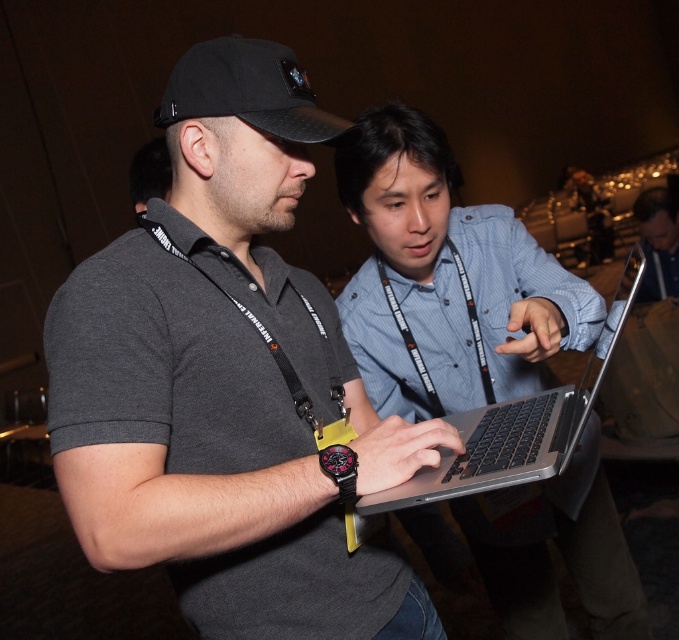
Please provide the exact coordinates of the dark gray polo shirt at center in the image. The coordinate system uses the bottom left corner as the origin point. The x and y values are normalized between 0 and 1. Please answer in the format of a coordinate pair, such as 0.5,0.5.

The exact coordinates of the dark gray polo shirt at center are [227,380].

You are a photographer standing behind the two people in the image. You want to take a photo of the dark gray polo shirt at center and the blue denim shirt at center such that both are fully visible. Based on their positions, which shirt should you focus on first to ensure both are in frame?

The dark gray polo shirt at center is located above the blue denim shirt at center, so you should focus on the blue denim shirt at center first to ensure both are in frame.

Based on the photo, you are a photographer trying to capture a candid shot of the two people working on the laptop. You notice a specific point in the image at coordinates point (251,92). What object is located at that point?

The point (251,92) corresponds to the black fabric baseball cap at upper center.